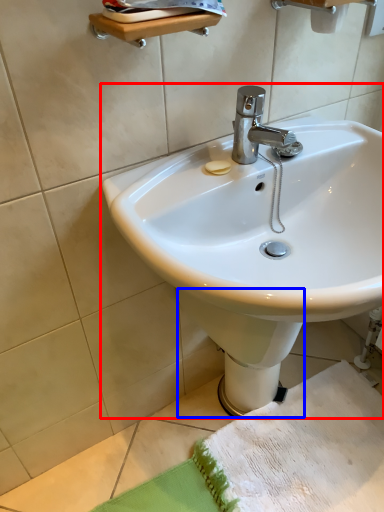
Question: Among these objects, which one is farthest to the camera, sink (highlighted by a red box) or bidet (highlighted by a blue box)?

Choices:
 (A) sink
 (B) bidet

Answer: (B)